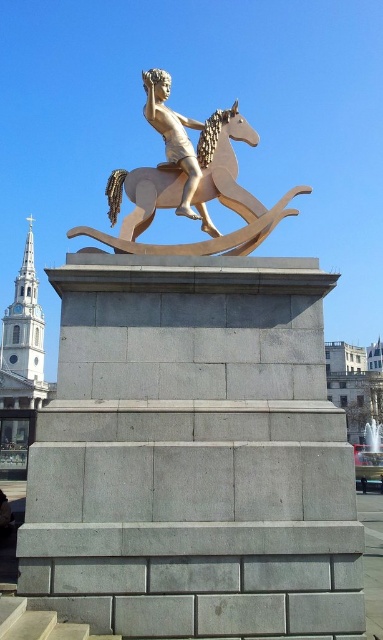
Question: Does gold polished horse at center have a lesser width compared to gold polished statue at center?

Choices:
 (A) yes
 (B) no

Answer: (B)

Question: Is gold polished horse at center below gold polished statue at center?

Choices:
 (A) no
 (B) yes

Answer: (B)

Question: Is gold polished horse at center to the right of gold polished statue at center from the viewer's perspective?

Choices:
 (A) no
 (B) yes

Answer: (B)

Question: Which point appears closest to the camera in this image?

Choices:
 (A) (188, 208)
 (B) (119, 250)

Answer: (B)